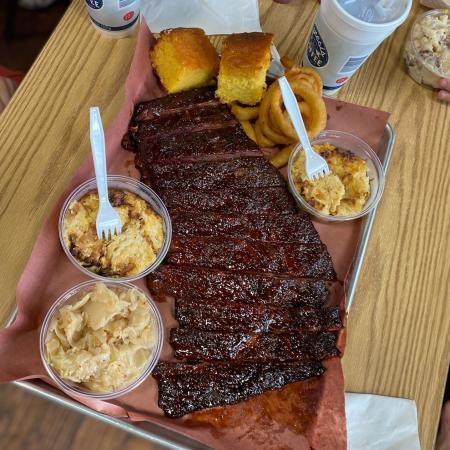
Where is `cup`? This screenshot has height=450, width=450. cup is located at coordinates (111, 23).